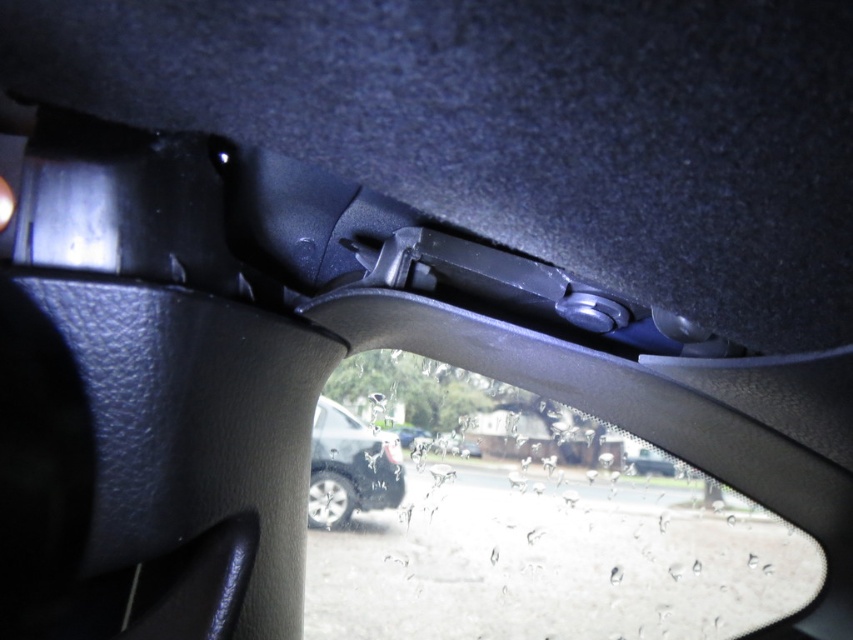
Question: From the image, what is the correct spatial relationship of transparent plastic car window at center in relation to satin silver car at center?

Choices:
 (A) below
 (B) above

Answer: (A)

Question: Which point appears closest to the camera in this image?

Choices:
 (A) (350, 458)
 (B) (457, 600)

Answer: (A)

Question: Among these points, which one is farthest from the camera?

Choices:
 (A) (x=590, y=458)
 (B) (x=312, y=476)

Answer: (A)

Question: Which point appears farthest from the camera in this image?

Choices:
 (A) (566, 532)
 (B) (352, 429)

Answer: (A)

Question: Is transparent plastic car window at center bigger than satin silver car at center?

Choices:
 (A) no
 (B) yes

Answer: (B)

Question: Is transparent plastic car window at center wider than satin silver car at center?

Choices:
 (A) no
 (B) yes

Answer: (B)